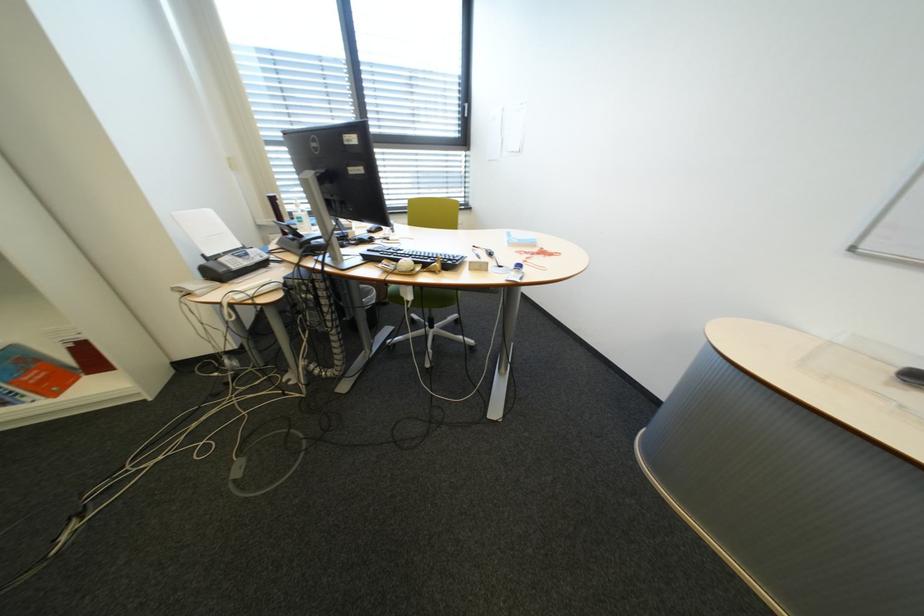
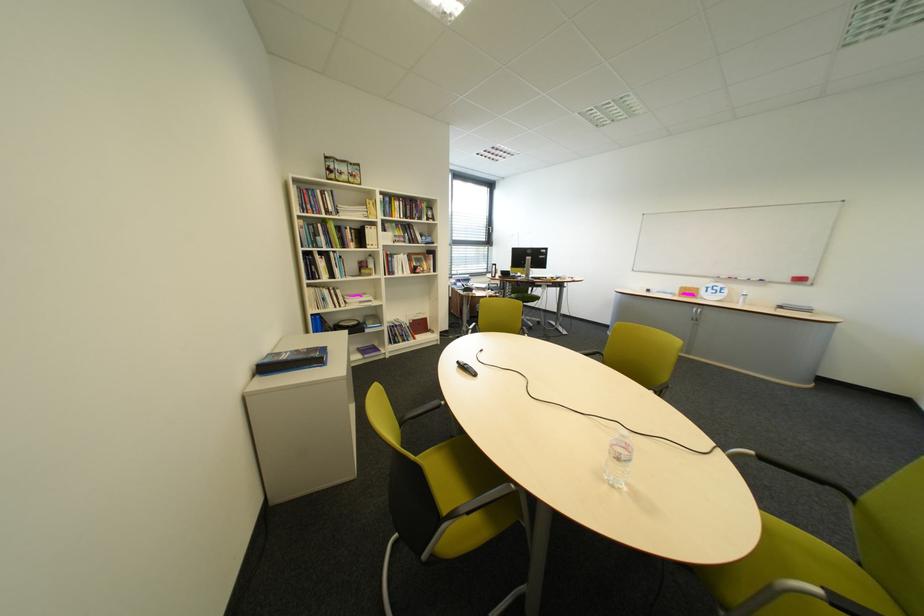
The images are taken continuously from a first-person perspective. In which direction are you moving?

The cameraman moved toward left, backward.